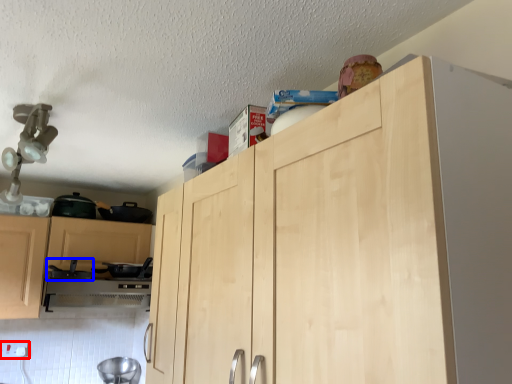
Question: Which of the following is the closest to the observer, electric outlet (highlighted by a red box) or appliance (highlighted by a blue box)?

Choices:
 (A) electric outlet
 (B) appliance

Answer: (B)